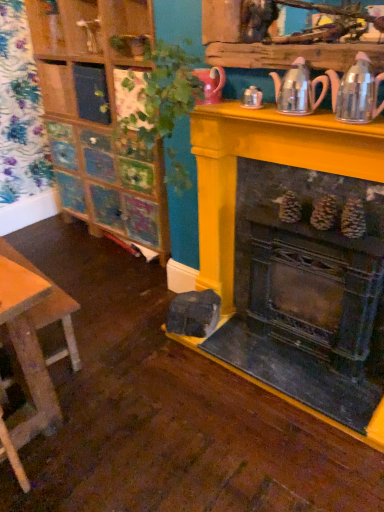
Where is `free space in front of rustic metal fireplace at center`? free space in front of rustic metal fireplace at center is located at coordinates (301, 380).